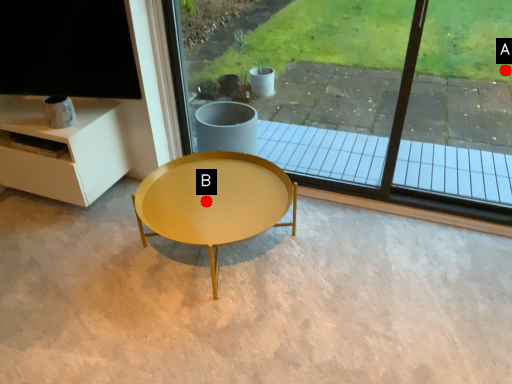
Question: Two points are circled on the image, labeled by A and B beside each circle. Which point appears closest to the camera in this image?

Choices:
 (A) A is closer
 (B) B is closer

Answer: (B)